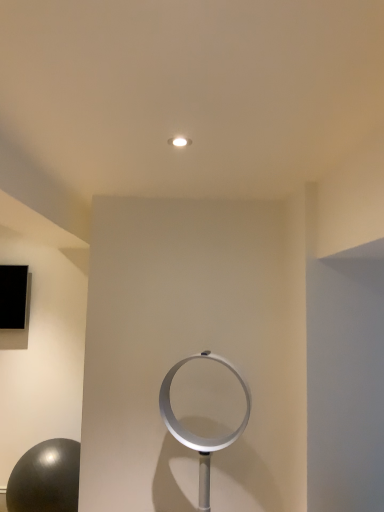
Question: Which is correct: shiny black ball at lower left is inside silver metallic fan at center, or outside of it?

Choices:
 (A) inside
 (B) outside

Answer: (B)

Question: Considering their positions, is shiny black ball at lower left located in front of or behind silver metallic fan at center?

Choices:
 (A) front
 (B) behind

Answer: (B)

Question: Is point (48, 461) positioned closer to the camera than point (178, 367)?

Choices:
 (A) closer
 (B) farther

Answer: (B)

Question: Looking at the image, does silver metallic fan at center seem bigger or smaller compared to shiny black ball at lower left?

Choices:
 (A) small
 (B) big

Answer: (A)

Question: Is silver metallic fan at center inside or outside of shiny black ball at lower left?

Choices:
 (A) outside
 (B) inside

Answer: (A)

Question: From the image's perspective, is silver metallic fan at center located above or below shiny black ball at lower left?

Choices:
 (A) below
 (B) above

Answer: (B)

Question: Is silver metallic fan at center wider or thinner than shiny black ball at lower left?

Choices:
 (A) wide
 (B) thin

Answer: (B)